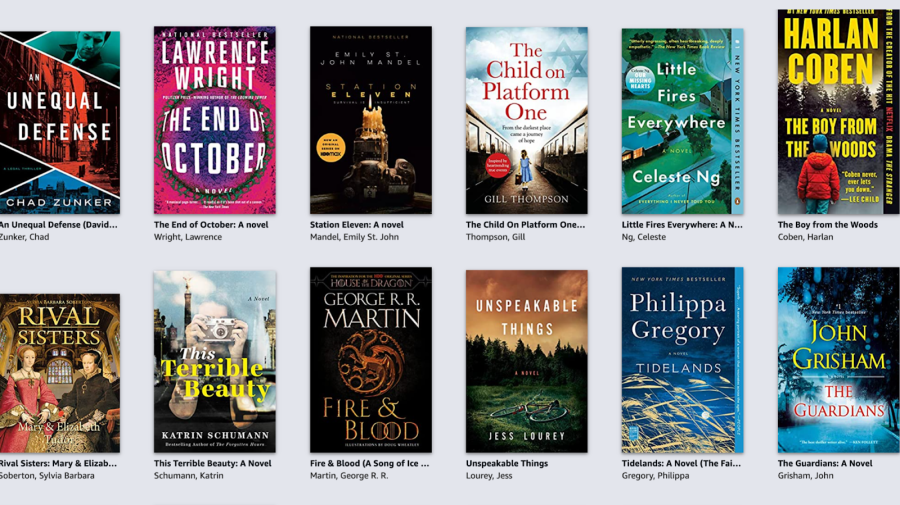
This screenshot has width=900, height=505. Identify the location of books in top row. (64, 135), (228, 147), (372, 136), (525, 129), (669, 122), (833, 104).